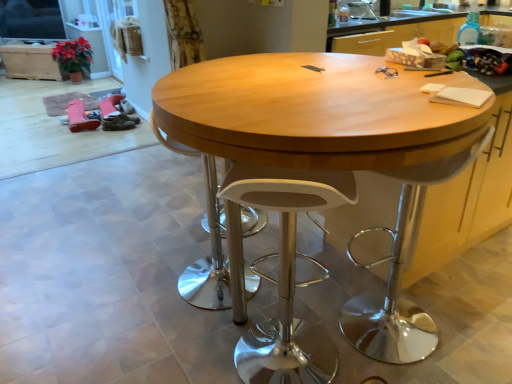
The height and width of the screenshot is (384, 512). Find the location of `free space in front of white plastic swivel chair at center, the first swivel chair when ordered from left to right`. free space in front of white plastic swivel chair at center, the first swivel chair when ordered from left to right is located at coordinates (x=189, y=338).